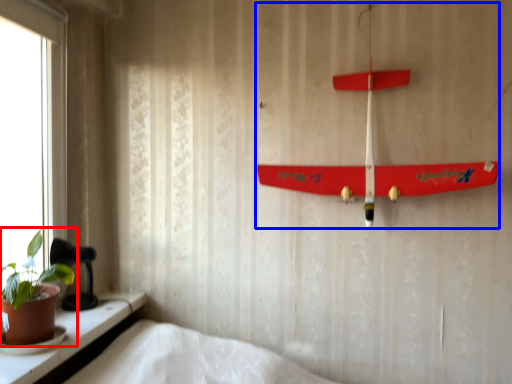
Question: Which object appears closest to the camera in this image, houseplant (highlighted by a red box) or toy (highlighted by a blue box)?

Choices:
 (A) houseplant
 (B) toy

Answer: (A)